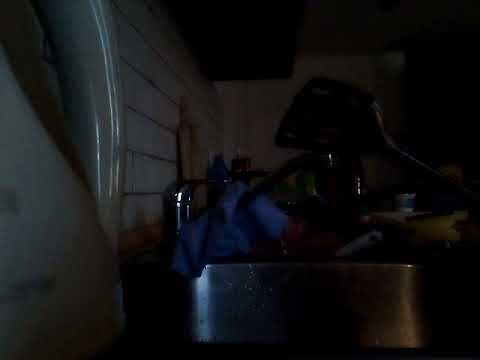
Locate an element on the screen. The width and height of the screenshot is (480, 360). wall is located at coordinates (132, 162), (262, 104).